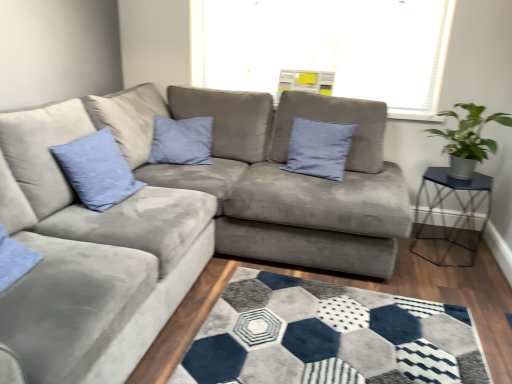
Question: Is blue fabric pillow at center, which is the second pillow from left to right, facing towards matte blue cushion at upper left, acting as the 2th pillow starting from the right?

Choices:
 (A) yes
 (B) no

Answer: (B)

Question: Is blue fabric pillow at center, the 2th pillow in the front-to-back sequence, to the left of matte blue cushion at upper left, the 1th pillow positioned from the front, from the viewer's perspective?

Choices:
 (A) no
 (B) yes

Answer: (A)

Question: Would you say matte blue cushion at upper left, the 1th pillow positioned from the front, is part of blue fabric pillow at center, the first pillow positioned from the right,'s contents?

Choices:
 (A) no
 (B) yes

Answer: (A)

Question: Considering the relative sizes of blue fabric pillow at center, the 2th pillow in the front-to-back sequence, and matte blue cushion at upper left, the second pillow viewed from the back, in the image provided, is blue fabric pillow at center, the 2th pillow in the front-to-back sequence, smaller than matte blue cushion at upper left, the second pillow viewed from the back,?

Choices:
 (A) yes
 (B) no

Answer: (A)

Question: Considering the relative sizes of blue fabric pillow at center, the first pillow positioned from the right, and matte blue cushion at upper left, the second pillow viewed from the back, in the image provided, is blue fabric pillow at center, the first pillow positioned from the right, wider than matte blue cushion at upper left, the second pillow viewed from the back,?

Choices:
 (A) yes
 (B) no

Answer: (B)

Question: From the image's perspective, is green leafy plant in metallic pot at right located beneath suede gray couch at center?

Choices:
 (A) yes
 (B) no

Answer: (B)

Question: Is green leafy plant in metallic pot at right wider than suede gray couch at center?

Choices:
 (A) yes
 (B) no

Answer: (B)

Question: Is green leafy plant in metallic pot at right facing towards suede gray couch at center?

Choices:
 (A) yes
 (B) no

Answer: (B)

Question: Considering the relative positions of green leafy plant in metallic pot at right and suede gray couch at center in the image provided, is green leafy plant in metallic pot at right to the right of suede gray couch at center from the viewer's perspective?

Choices:
 (A) yes
 (B) no

Answer: (A)

Question: Could suede gray couch at center be considered to be inside green leafy plant in metallic pot at right?

Choices:
 (A) no
 (B) yes

Answer: (A)

Question: Can you confirm if green leafy plant in metallic pot at right is positioned to the left of suede gray couch at center?

Choices:
 (A) yes
 (B) no

Answer: (B)

Question: From the image's perspective, is green leafy plant in metallic pot at right on matte blue cushion at upper left, acting as the 2th pillow starting from the right?

Choices:
 (A) no
 (B) yes

Answer: (B)